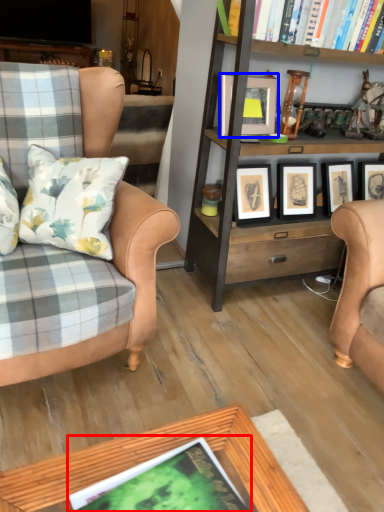
Question: Which of the following is the closest to the observer, book (highlighted by a red box) or picture frame (highlighted by a blue box)?

Choices:
 (A) book
 (B) picture frame

Answer: (A)